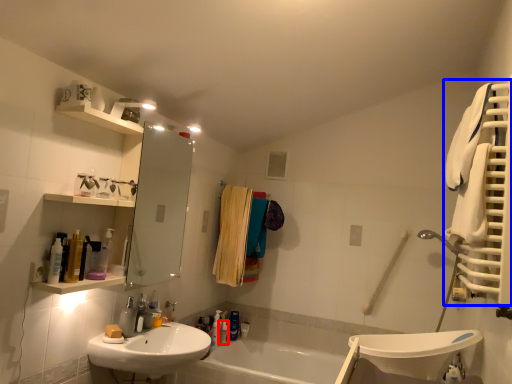
Question: Among these objects, which one is nearest to the camera, toiletry (highlighted by a red box) or bath towel (highlighted by a blue box)?

Choices:
 (A) toiletry
 (B) bath towel

Answer: (B)